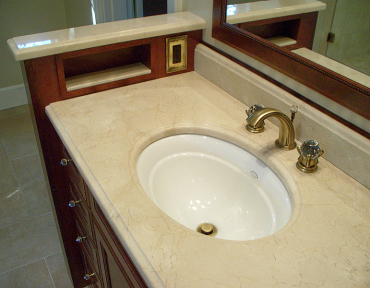
Where is `floor`? floor is located at coordinates (x=16, y=202).